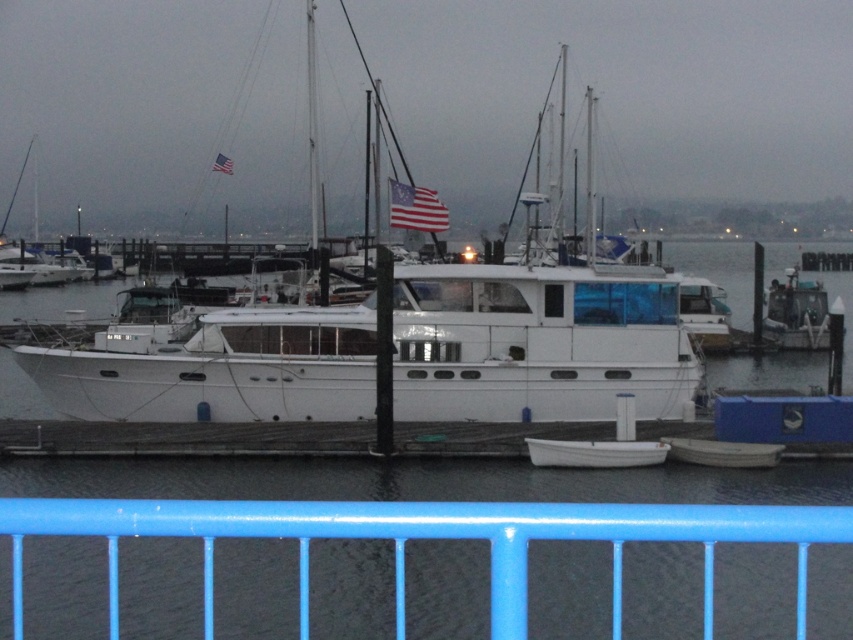
Between point (538, 301) and point (103, 388), which one is positioned in front?

Point (103, 388) is more forward.

Can you confirm if white matte boat at center is taller than white glossy boat at center?

Yes, white matte boat at center is taller than white glossy boat at center.

Who is more distant from viewer, (311,68) or (608,273)?

Positioned behind is point (311,68).

The image size is (853, 640). I want to click on white matte boat at center, so click(404, 349).

Does white matte water at center have a larger size compared to white matte boat at center?

No.

Who is positioned more to the left, white matte water at center or white matte boat at center?

Positioned to the left is white matte boat at center.

The width and height of the screenshot is (853, 640). I want to click on white matte water at center, so click(x=419, y=481).

Is white matte boat at lower center bigger than american flag at center?

Incorrect, white matte boat at lower center is not larger than american flag at center.

Which of these two, white matte boat at lower center or american flag at center, stands shorter?

white matte boat at lower center is shorter.

This screenshot has height=640, width=853. Find the location of `white matte boat at lower center`. white matte boat at lower center is located at coordinates (722, 452).